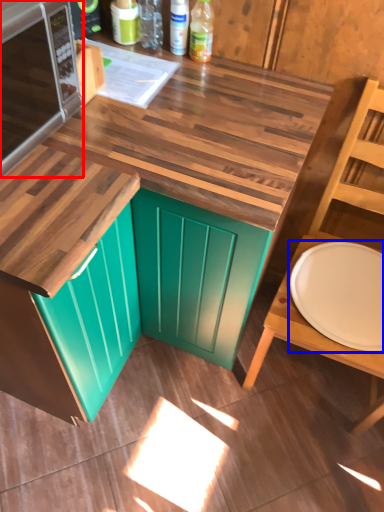
Question: Which point is further to the camera, microwave oven (highlighted by a red box) or plate (highlighted by a blue box)?

Choices:
 (A) microwave oven
 (B) plate

Answer: (B)